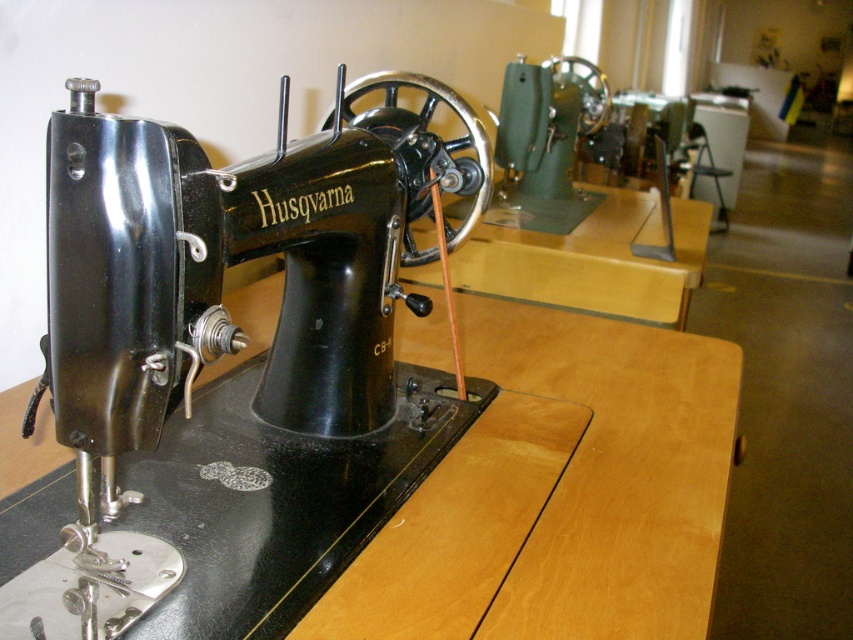
You are setting up a display for a vintage sewing machine exhibition. The black metal sewing machine at center needs to be placed on the wooden table at center. Can the sewing machine fit on the table without overhanging the edges?

The black metal sewing machine at center is thinner than the wooden table at center, so it should fit without overhanging the edges since its width is narrower than the table.

Consider the image. What is the position of the black metal sewing machine at center relative to the wooden table at center?

The black metal sewing machine at center is positioned to the left of the wooden table at center according to the description.

You are a furniture designer observing the vintage Husqvarna sewing machine and the wooden table. Which object is taller between the black metal sewing machine at center and the wooden table at center?

The black metal sewing machine at center is taller than the wooden table at center according to the description.